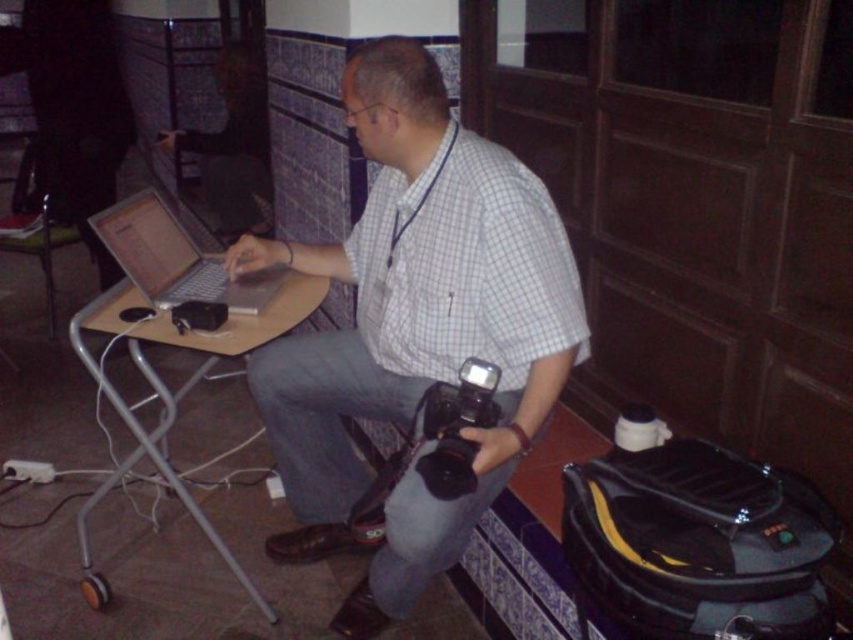
Does white checkered shirt at center have a greater width compared to silver metallic laptop at center?

Correct, the width of white checkered shirt at center exceeds that of silver metallic laptop at center.

Find the location of a particular element. This screenshot has width=853, height=640. white checkered shirt at center is located at coordinates (415, 326).

Locate an element on the screen. The height and width of the screenshot is (640, 853). white checkered shirt at center is located at coordinates pos(415,326).

Consider the image. Is white checkered shirt at center to the left of black plastic video camera at lower center from the viewer's perspective?

Yes, white checkered shirt at center is to the left of black plastic video camera at lower center.

Is white checkered shirt at center wider than black plastic video camera at lower center?

Yes, white checkered shirt at center is wider than black plastic video camera at lower center.

What are the coordinates of `white checkered shirt at center` in the screenshot? It's located at (415, 326).

The width and height of the screenshot is (853, 640). Identify the location of white checkered shirt at center. (415, 326).

Who is taller, wooden table at center or black plastic video camera at lower center?

wooden table at center

Between point (308, 292) and point (444, 438), which one is positioned in front?

Point (444, 438)

Where is `wooden table at center`? The height and width of the screenshot is (640, 853). wooden table at center is located at coordinates coord(178,388).